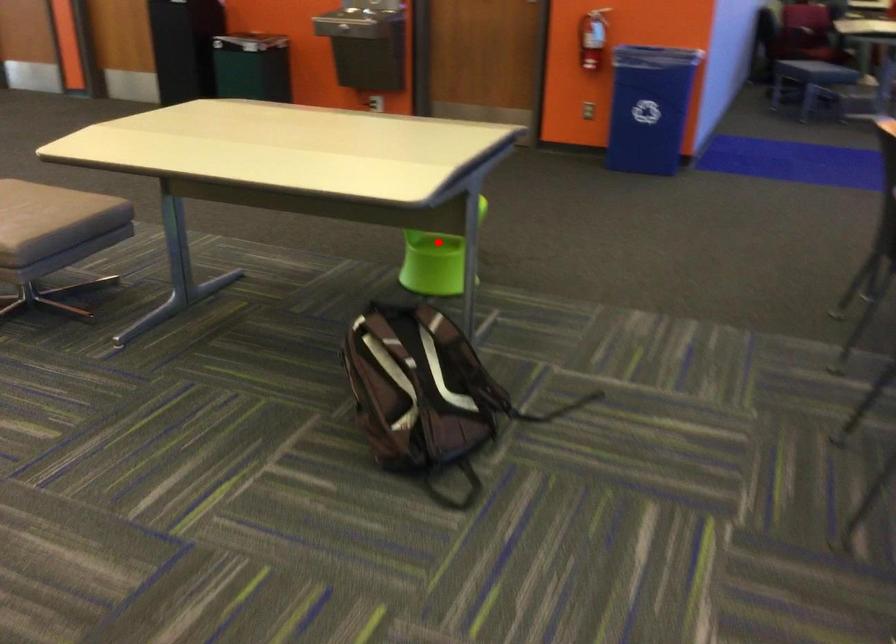
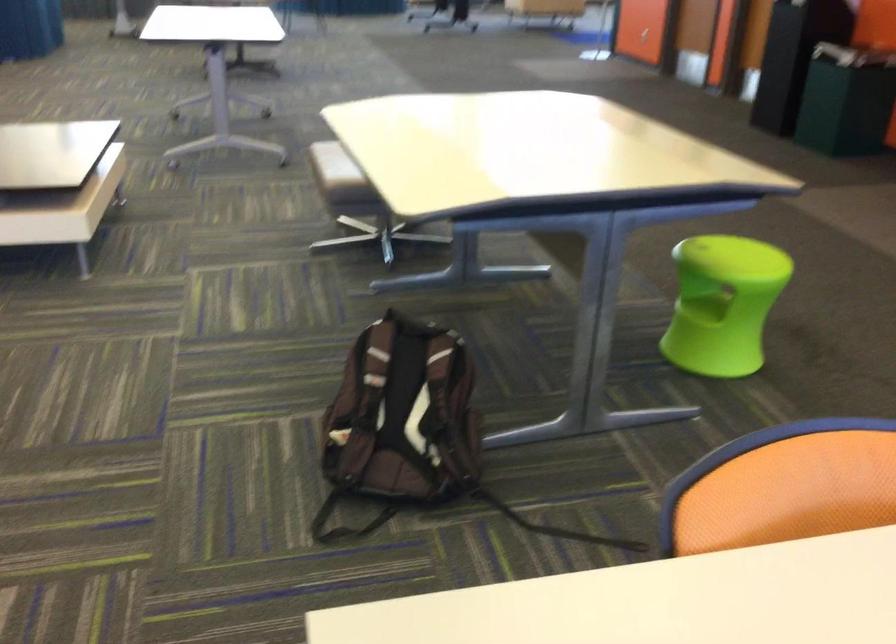
Locate, in the second image, the point that corresponds to the highlighted location in the first image.

(702, 307)